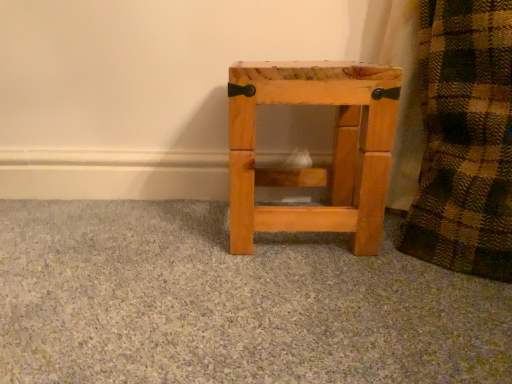
Question: Is the surface of natural wood stool at center in direct contact with natural wood stool at center?

Choices:
 (A) no
 (B) yes

Answer: (A)

Question: Considering the relative sizes of natural wood stool at center and natural wood stool at center in the image provided, is natural wood stool at center shorter than natural wood stool at center?

Choices:
 (A) no
 (B) yes

Answer: (B)

Question: Does natural wood stool at center have a greater height compared to natural wood stool at center?

Choices:
 (A) no
 (B) yes

Answer: (A)

Question: From a real-world perspective, is natural wood stool at center beneath natural wood stool at center?

Choices:
 (A) yes
 (B) no

Answer: (A)

Question: Can you confirm if natural wood stool at center is wider than natural wood stool at center?

Choices:
 (A) yes
 (B) no

Answer: (A)

Question: Is natural wood stool at center smaller than natural wood stool at center?

Choices:
 (A) no
 (B) yes

Answer: (A)

Question: From the image's perspective, is natural wood stool at center beneath natural wood stool at center?

Choices:
 (A) yes
 (B) no

Answer: (B)

Question: Can you confirm if natural wood stool at center is shorter than natural wood stool at center?

Choices:
 (A) no
 (B) yes

Answer: (A)

Question: Could you tell me if natural wood stool at center is facing natural wood stool at center?

Choices:
 (A) yes
 (B) no

Answer: (B)

Question: Is natural wood stool at center facing away from natural wood stool at center?

Choices:
 (A) yes
 (B) no

Answer: (B)

Question: Are natural wood stool at center and natural wood stool at center beside each other?

Choices:
 (A) yes
 (B) no

Answer: (B)

Question: Is natural wood stool at center to the right of natural wood stool at center from the viewer's perspective?

Choices:
 (A) yes
 (B) no

Answer: (A)

Question: In terms of size, does natural wood stool at center appear bigger or smaller than natural wood stool at center?

Choices:
 (A) small
 (B) big

Answer: (A)